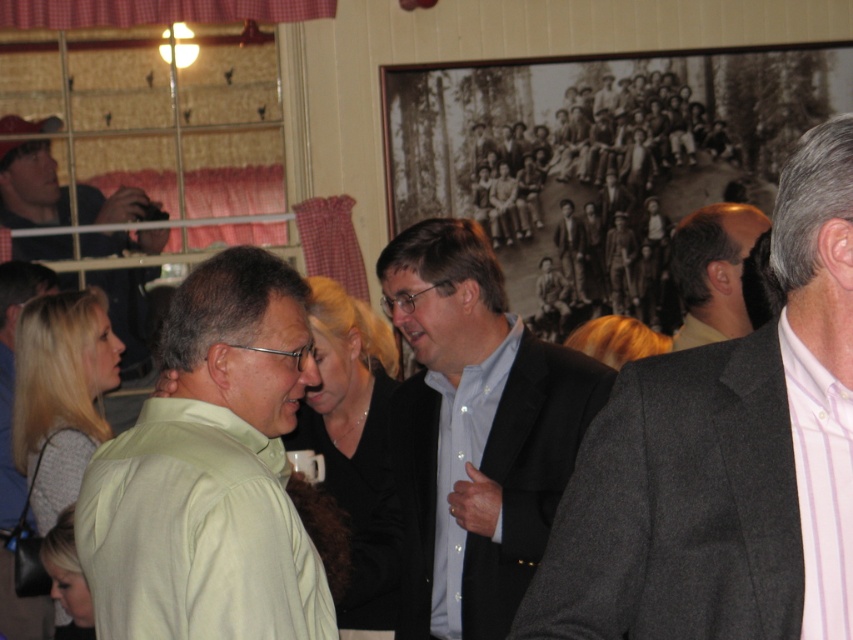
In the scene shown: You are standing in the social gathering scene. There are two points marked in the image. The first point is at coordinates point (x=514, y=326) and the second point is at point (x=148, y=216). Which of these two points is closer to you?

Point (x=514, y=326) is closer to the viewer than point (x=148, y=216).